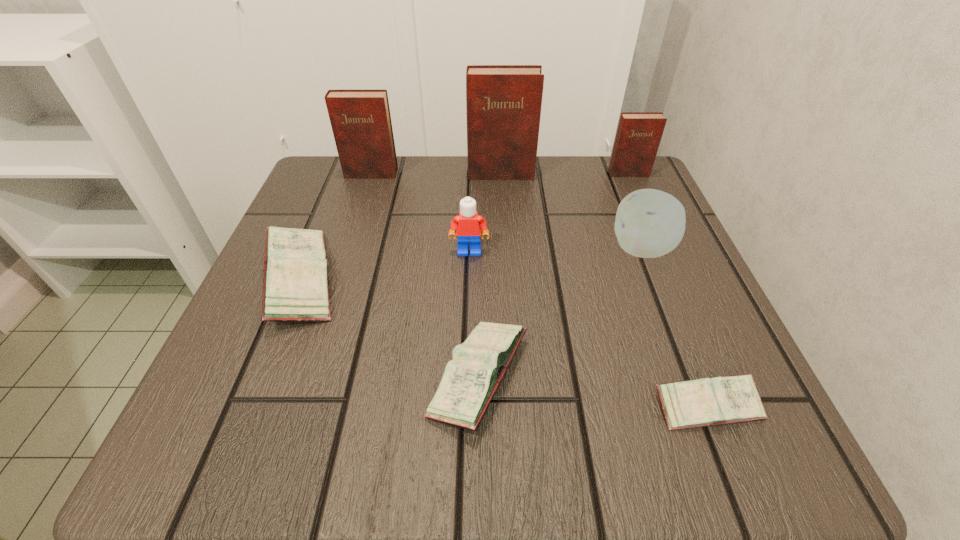
In order to click on the tallest object in this screenshot , I will do `click(503, 102)`.

At what (x,y) coordinates should I click in order to perform the action: click on the tallest diary. Please return your answer as a coordinate pair (x, y). Looking at the image, I should click on (503, 102).

This screenshot has width=960, height=540. I want to click on the leftmost reddish-brown diary, so click(x=361, y=123).

Identify the location of the seventh shortest object. pyautogui.click(x=361, y=123).

The height and width of the screenshot is (540, 960). I want to click on the fourth shortest diary, so click(638, 136).

Locate an element on the screen. This screenshot has width=960, height=540. the rightmost reddish-brown diary is located at coordinates (638, 136).

Identify the location of white Lego. The width and height of the screenshot is (960, 540). (467, 226).

Locate an element on the screen. The width and height of the screenshot is (960, 540). apple is located at coordinates (650, 223).

You are a GUI agent. You are given a task and a screenshot of the screen. Output one action in this format:
    pyautogui.click(x=<x>, y=<y>)
    Task: Click on the sixth tallest object
    
    Given the screenshot: What is the action you would take?
    pyautogui.click(x=295, y=286)

You are a GUI agent. You are given a task and a screenshot of the screen. Output one action in this format:
    pyautogui.click(x=<x>, y=<y>)
    Task: Click on the leftmost pink diary
    This screenshot has height=540, width=960.
    Given the screenshot: What is the action you would take?
    295,286